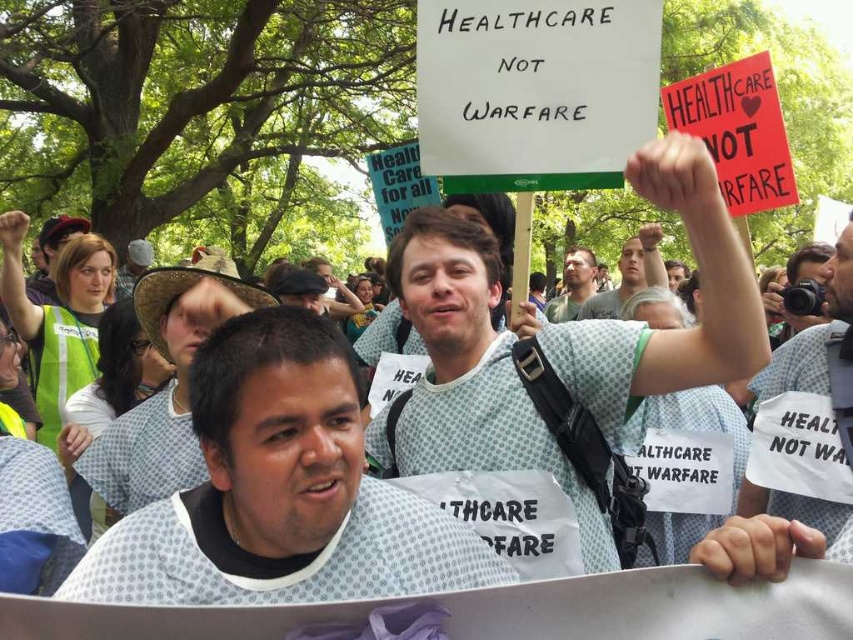
Question: Is light gray shirt at center to the right of light brown hair at center from the viewer's perspective?

Choices:
 (A) yes
 (B) no

Answer: (A)

Question: Which point is closer to the camera?

Choices:
 (A) (570, 276)
 (B) (621, 250)
 (C) (236, 484)

Answer: (C)

Question: Is white fabric shirt at center closer to camera compared to white dotted hospital gown at center?

Choices:
 (A) yes
 (B) no

Answer: (A)

Question: Among these points, which one is nearest to the camera?

Choices:
 (A) (647, 259)
 (B) (93, 564)
 (C) (560, 320)

Answer: (B)

Question: Considering the real-world distances, which object is closest to the white fabric shirt at center?

Choices:
 (A) light brown hair at center
 (B) white paper sign at upper center
 (C) white dotted hospital gown at center
 (D) light gray shirt at center

Answer: (C)

Question: Is the position of light gray shirt at center more distant than that of light brown hair at center?

Choices:
 (A) no
 (B) yes

Answer: (A)